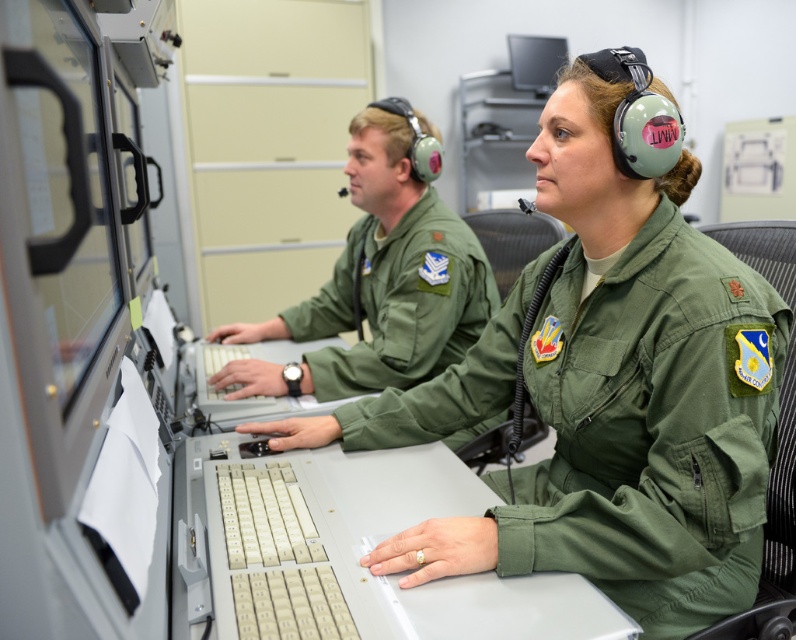
Question: Which point is farther from the camera taking this photo?

Choices:
 (A) (547, 90)
 (B) (229, 378)
 (C) (451, 548)

Answer: (A)

Question: Is green fabric uniform at center closer to camera compared to black glossy monitor at upper center?

Choices:
 (A) no
 (B) yes

Answer: (B)

Question: Is green fabric uniform at center smaller than green matte uniform at center?

Choices:
 (A) no
 (B) yes

Answer: (A)

Question: Which object is the closest to the green fabric uniform at center?

Choices:
 (A) green matte uniform at center
 (B) black glossy monitor at upper center

Answer: (A)

Question: Which object is the farthest from the green fabric uniform at center?

Choices:
 (A) black glossy monitor at upper center
 (B) green matte uniform at center

Answer: (A)

Question: Is green fabric uniform at center smaller than green matte uniform at center?

Choices:
 (A) yes
 (B) no

Answer: (B)